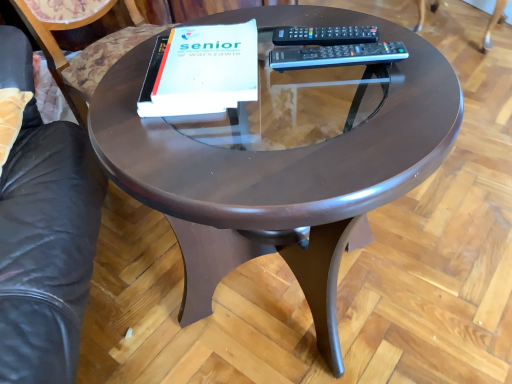
This screenshot has width=512, height=384. What do you see at coordinates (337, 55) in the screenshot?
I see `black plastic remote at upper right, the 2th remote when ordered from top to bottom` at bounding box center [337, 55].

This screenshot has height=384, width=512. Identify the location of black plastic remote at upper right, the first remote from the back. (325, 35).

Which is more to the right, black plastic remote at upper right, which is the second remote in back-to-front order, or black plastic remote at upper right, placed as the second remote when sorted from bottom to top?

From the viewer's perspective, black plastic remote at upper right, which is the second remote in back-to-front order, appears more on the right side.

Are black plastic remote at upper right, which ranks as the first remote in bottom-to-top order, and black plastic remote at upper right, the first remote from the back, beside each other?

Yes, the surface of black plastic remote at upper right, which ranks as the first remote in bottom-to-top order, is in contact with black plastic remote at upper right, the first remote from the back.

Is black plastic remote at upper right, which is the second remote in back-to-front order, looking in the opposite direction of black plastic remote at upper right, the second remote viewed from the front?

No, black plastic remote at upper right, which is the second remote in back-to-front order,'s orientation is not away from black plastic remote at upper right, the second remote viewed from the front.

Considering the sizes of black plastic remote at upper right, the first remote when ordered from front to back, and black plastic remote at upper right, the first remote in the top-to-bottom sequence, in the image, is black plastic remote at upper right, the first remote when ordered from front to back, wider or thinner than black plastic remote at upper right, the first remote in the top-to-bottom sequence,?

Considering their sizes, black plastic remote at upper right, the first remote when ordered from front to back, looks broader than black plastic remote at upper right, the first remote in the top-to-bottom sequence.

In order to click on coffee table located below the wooden swivel chair at upper right (from the image's perspective) in this screenshot , I will do `click(279, 169)`.

Between point (332, 228) and point (500, 21), which one is positioned in front?

The point (332, 228) is closer.

Can you confirm if shiny brown table at center is smaller than wooden swivel chair at upper right?

No, shiny brown table at center is not smaller than wooden swivel chair at upper right.

Between shiny brown table at center and wooden swivel chair at upper right, which one has less height?

Standing shorter between the two is shiny brown table at center.

From the image's perspective, between white matte paper at center and black plastic remote at upper right, the 2th remote when ordered from top to bottom, who is located below?

white matte paper at center, from the image's perspective.

Between white matte paper at center and black plastic remote at upper right, the first remote when ordered from front to back, which one appears on the left side from the viewer's perspective?

white matte paper at center is more to the left.

Is white matte paper at center positioned beyond the bounds of black plastic remote at upper right, the 2th remote when ordered from top to bottom?

Indeed, white matte paper at center is completely outside black plastic remote at upper right, the 2th remote when ordered from top to bottom.

Which of these two, shiny brown table at center or black plastic remote at upper right, which is the second remote in back-to-front order, is thinner?

Thinner between the two is black plastic remote at upper right, which is the second remote in back-to-front order.

Would you consider shiny brown table at center to be distant from black plastic remote at upper right, which is the second remote in back-to-front order?

No.

Locate an element on the screen. The image size is (512, 384). coffee table directly beneath the black plastic remote at upper right, which is the second remote in back-to-front order (from a real-world perspective) is located at coordinates (279, 169).

Consider the image. Is shiny brown table at center aimed at black plastic remote at upper right, the first remote when ordered from front to back?

No.

Which is correct: white matte paper at center is inside wooden swivel chair at upper right, or outside of it?

white matte paper at center exists outside the volume of wooden swivel chair at upper right.

Is white matte paper at center far away from wooden swivel chair at upper right?

Indeed, white matte paper at center is not near wooden swivel chair at upper right.

Where is `paperback book below the wooden swivel chair at upper right (from the image's perspective)`? This screenshot has height=384, width=512. paperback book below the wooden swivel chair at upper right (from the image's perspective) is located at coordinates (201, 71).

What's the angular difference between white matte paper at center and wooden swivel chair at upper right's facing directions?

126 degrees separate the facing orientations of white matte paper at center and wooden swivel chair at upper right.

Which is more to the left, wooden swivel chair at upper right or shiny brown table at center?

shiny brown table at center is more to the left.

Is wooden swivel chair at upper right not inside shiny brown table at center?

Yes, wooden swivel chair at upper right is not within shiny brown table at center.

Which of these two, wooden swivel chair at upper right or shiny brown table at center, is bigger?

shiny brown table at center.

Based on the photo, is black plastic remote at upper right, placed as the second remote when sorted from bottom to top, turned away from shiny brown table at center?

No, black plastic remote at upper right, placed as the second remote when sorted from bottom to top, is not facing away from shiny brown table at center.

How far apart are black plastic remote at upper right, placed as the second remote when sorted from bottom to top, and shiny brown table at center?

The distance of black plastic remote at upper right, placed as the second remote when sorted from bottom to top, from shiny brown table at center is 11.81 inches.

Is there a large distance between black plastic remote at upper right, the second remote viewed from the front, and shiny brown table at center?

Actually, black plastic remote at upper right, the second remote viewed from the front, and shiny brown table at center are a little close together.

Based on the photo, does black plastic remote at upper right, placed as the second remote when sorted from bottom to top, lie in front of shiny brown table at center?

Yes, the depth of black plastic remote at upper right, placed as the second remote when sorted from bottom to top, is less than that of shiny brown table at center.

You are a GUI agent. You are given a task and a screenshot of the screen. Output one action in this format:
    pyautogui.click(x=<x>, y=<y>)
    Task: Click on the remote that is above the black plastic remote at upper right, which ranks as the first remote in bottom-to-top order (from the image's perspective)
    This screenshot has width=512, height=384.
    Given the screenshot: What is the action you would take?
    pyautogui.click(x=325, y=35)

The image size is (512, 384). I want to click on coffee table lying in front of the wooden swivel chair at upper right, so click(279, 169).

Estimate the real-world distances between objects in this image. Which object is closer to white matte paper at center, shiny brown table at center or wooden swivel chair at upper right?

shiny brown table at center is positioned closer to the anchor white matte paper at center.

From the image, which object appears to be nearer to shiny brown table at center, black plastic remote at upper right, which is the second remote in back-to-front order, or black plastic remote at upper right, the first remote from the back?

black plastic remote at upper right, which is the second remote in back-to-front order, is positioned closer to the anchor shiny brown table at center.

From the image, which object appears to be nearer to white matte paper at center, black plastic remote at upper right, the first remote from the back, or black plastic remote at upper right, the 2th remote when ordered from top to bottom?

black plastic remote at upper right, the 2th remote when ordered from top to bottom.

Which object lies nearer to the anchor point shiny brown table at center, black plastic remote at upper right, the first remote from the back, or white matte paper at center?

white matte paper at center is closer to shiny brown table at center.

When comparing their distances from white matte paper at center, does black plastic remote at upper right, which ranks as the first remote in bottom-to-top order, or shiny brown table at center seem further?

shiny brown table at center.

When comparing their distances from wooden swivel chair at upper right, does black plastic remote at upper right, the first remote in the top-to-bottom sequence, or shiny brown table at center seem closer?

black plastic remote at upper right, the first remote in the top-to-bottom sequence, is positioned closer to the anchor wooden swivel chair at upper right.

When comparing their distances from shiny brown table at center, does white matte paper at center or black plastic remote at upper right, which ranks as the first remote in bottom-to-top order, seem further?

The object further to shiny brown table at center is black plastic remote at upper right, which ranks as the first remote in bottom-to-top order.

When comparing their distances from shiny brown table at center, does black plastic remote at upper right, the first remote in the top-to-bottom sequence, or wooden swivel chair at upper right seem closer?

Based on the image, black plastic remote at upper right, the first remote in the top-to-bottom sequence, appears to be nearer to shiny brown table at center.

I want to click on coffee table positioned between black plastic remote at upper right, placed as the second remote when sorted from bottom to top, and wooden swivel chair at upper right from near to far, so click(x=279, y=169).

This screenshot has height=384, width=512. I want to click on coffee table between black plastic remote at upper right, the first remote when ordered from front to back, and wooden swivel chair at upper right from front to back, so click(279, 169).

The width and height of the screenshot is (512, 384). I want to click on remote between black plastic remote at upper right, placed as the second remote when sorted from bottom to top, and shiny brown table at center, in the horizontal direction, so click(x=337, y=55).

Identify the location of coffee table located between white matte paper at center and wooden swivel chair at upper right in the depth direction. tap(279, 169).